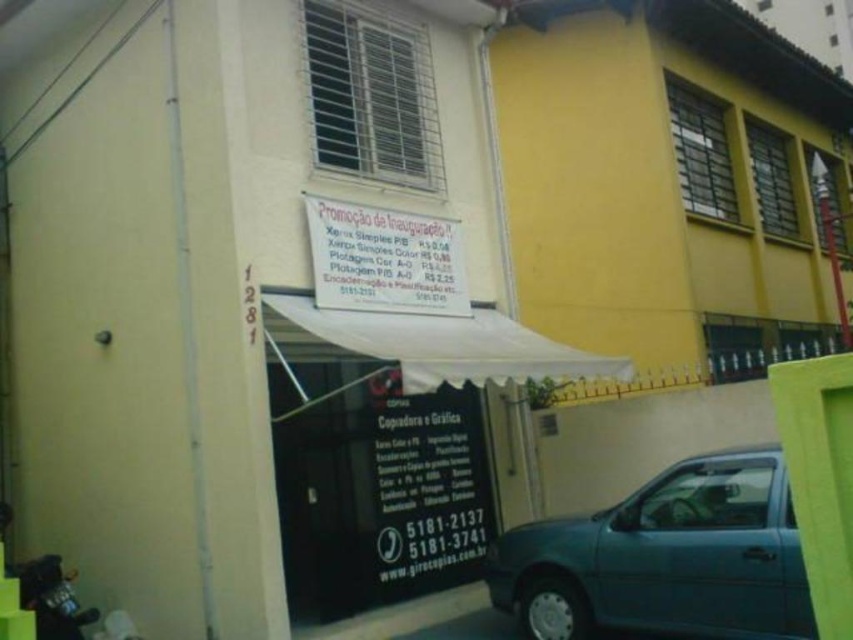
Question: Is teal metallic car at lower right positioned behind white paper sign at center?

Choices:
 (A) no
 (B) yes

Answer: (A)

Question: Can you confirm if teal metallic car at lower right is wider than black paperboard at center?

Choices:
 (A) no
 (B) yes

Answer: (B)

Question: Among these objects, which one is nearest to the camera?

Choices:
 (A) teal metallic car at lower right
 (B) black paperboard at center

Answer: (A)

Question: Which of the following is the farthest from the observer?

Choices:
 (A) black paperboard at center
 (B) white fabric canopy at center

Answer: (A)

Question: Is teal metallic car at lower right positioned behind white paper sign at center?

Choices:
 (A) no
 (B) yes

Answer: (A)

Question: Which of the following is the farthest from the observer?

Choices:
 (A) (752, 525)
 (B) (506, 321)

Answer: (B)